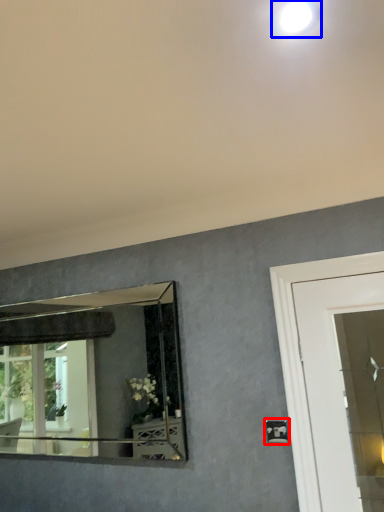
Question: Which object appears farthest to the camera in this image, light switch (highlighted by a red box) or droplight (highlighted by a blue box)?

Choices:
 (A) light switch
 (B) droplight

Answer: (A)